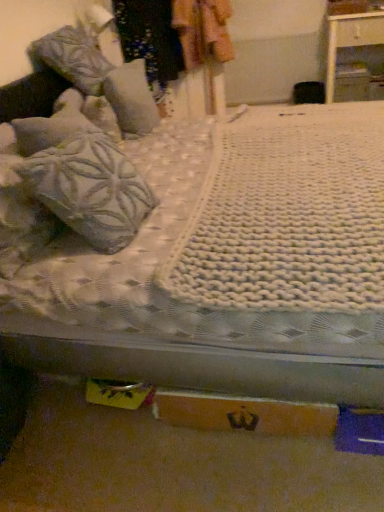
Question: Based on their sizes in the image, would you say textured gray pillow at upper left, which is the first pillow from back to front, is bigger or smaller than patterned fabric at upper center?

Choices:
 (A) small
 (B) big

Answer: (A)

Question: From their relative heights in the image, would you say textured gray pillow at upper left, which is the first pillow from back to front, is taller or shorter than patterned fabric at upper center?

Choices:
 (A) short
 (B) tall

Answer: (A)

Question: Which is farther from the textured gray pillow at left, which is the 2th pillow from back to front?

Choices:
 (A) textured gray pillow at upper left, which is the 2th pillow from front to back
 (B) white knitted blanket at center
 (C) white glossy nightstand at upper right
 (D) patterned fabric at upper center
 (E) orange cardboard box at lower center

Answer: (C)

Question: Estimate the real-world distances between objects in this image. Which object is closer to the white knitted blanket at center?

Choices:
 (A) textured gray pillow at left, which is the 2th pillow from back to front
 (B) textured gray pillow at upper left, which is the first pillow from back to front
 (C) patterned fabric at upper center
 (D) white glossy nightstand at upper right
 (E) orange cardboard box at lower center

Answer: (A)